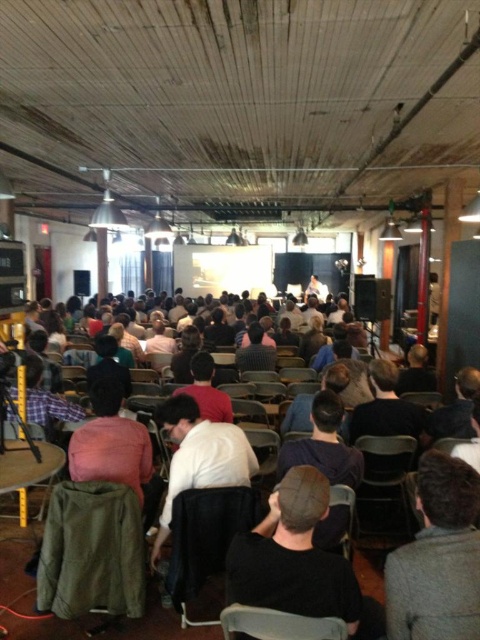
Who is positioned more to the left, black fabric cap at center or olive-green fabric chair at lower left?

olive-green fabric chair at lower left

Who is taller, black fabric cap at center or olive-green fabric chair at lower left?

black fabric cap at center is taller.

You are a GUI agent. You are given a task and a screenshot of the screen. Output one action in this format:
    pyautogui.click(x=<x>, y=<y>)
    Task: Click on the black fabric cap at center
    The height and width of the screenshot is (640, 480).
    Given the screenshot: What is the action you would take?
    pyautogui.click(x=299, y=561)

Which is more to the left, pink fabric at center or white plastic chair at lower center?

From the viewer's perspective, pink fabric at center appears more on the left side.

Can you confirm if pink fabric at center is positioned to the right of white plastic chair at lower center?

No, pink fabric at center is not to the right of white plastic chair at lower center.

Describe the element at coordinates (110, 444) in the screenshot. The width and height of the screenshot is (480, 640). I see `pink fabric at center` at that location.

You are a GUI agent. You are given a task and a screenshot of the screen. Output one action in this format:
    pyautogui.click(x=<x>, y=<y>)
    Task: Click on the pink fabric at center
    Image resolution: width=480 pixels, height=640 pixels.
    Given the screenshot: What is the action you would take?
    pyautogui.click(x=110, y=444)

Which is more to the left, olive-green fabric chair at lower left or white plastic chair at lower center?

Positioned to the left is olive-green fabric chair at lower left.

Does point (46, 609) lie in front of point (239, 616)?

No, (46, 609) is further to viewer.

Find the location of `olive-green fabric chair at lower left`. olive-green fabric chair at lower left is located at coordinates (92, 552).